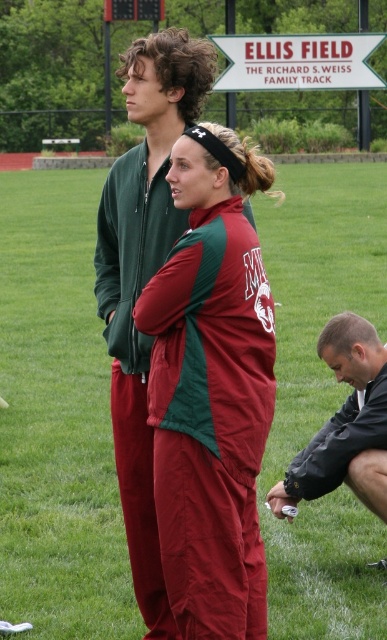
This screenshot has height=640, width=387. I want to click on green grass at center, so click(x=56, y=419).

Who is more distant from viewer, (46, 260) or (385, 508)?

The point (46, 260) is behind.

Which is behind, point (18, 225) or point (323, 433)?

Positioned behind is point (18, 225).

You are a GUI agent. You are given a task and a screenshot of the screen. Output one action in this format:
    pyautogui.click(x=<x>, y=<y>)
    Task: Click on the green grass at center
    The height and width of the screenshot is (640, 387).
    Given the screenshot: What is the action you would take?
    pyautogui.click(x=56, y=419)

What do you see at coordinates (210, 403) in the screenshot?
I see `maroon fabric tracksuit at center` at bounding box center [210, 403].

Does maroon fabric tracksuit at center have a larger size compared to black matte jacket at lower right?

Yes.

Does point (160, 358) come farther from viewer compared to point (340, 476)?

No, it is not.

Locate an element on the screen. maroon fabric tracksuit at center is located at coordinates (210, 403).

Which is below, green grass at center or maroon fabric tracksuit at center?

Positioned lower is maroon fabric tracksuit at center.

Who is positioned more to the left, green grass at center or maroon fabric tracksuit at center?

From the viewer's perspective, green grass at center appears more on the left side.

Measure the distance between green grass at center and camera.

The distance of green grass at center from camera is 5.49 meters.

In order to click on green grass at center in this screenshot , I will do `click(56, 419)`.